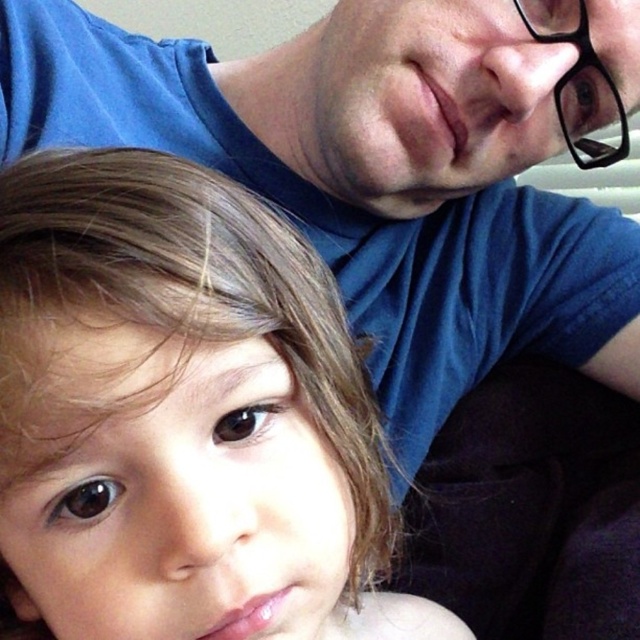
Who is taller, smooth skin child at lower left or black plastic glasses at upper right?

smooth skin child at lower left

Find the location of `smooth skin child at lower left`. smooth skin child at lower left is located at coordinates (180, 417).

This screenshot has height=640, width=640. What do you see at coordinates (180, 417) in the screenshot? I see `smooth skin child at lower left` at bounding box center [180, 417].

Locate an element on the screen. smooth skin child at lower left is located at coordinates 180,417.